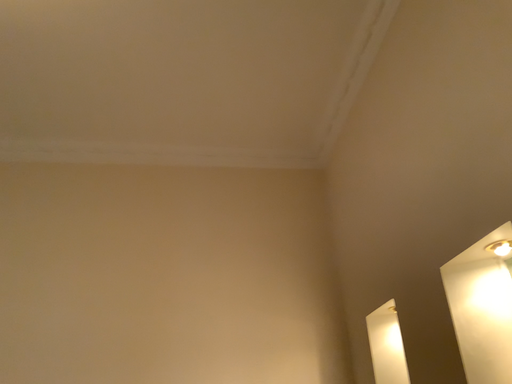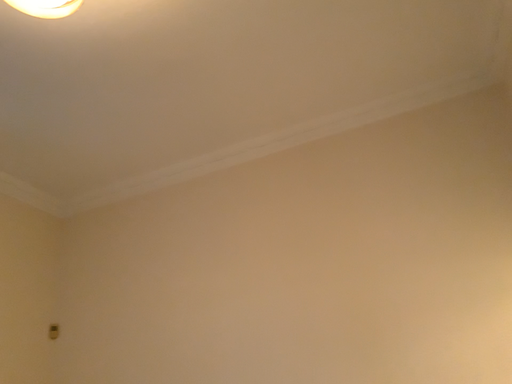
Question: How did the camera likely rotate when shooting the video?

Choices:
 (A) rotated upward
 (B) rotated downward

Answer: (B)